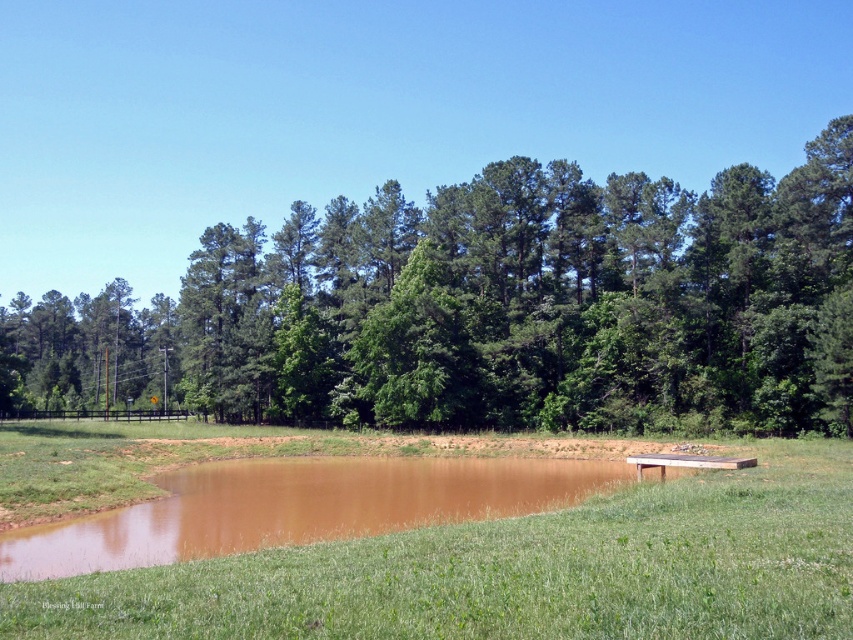
Question: Among these points, which one is farthest from the camera?

Choices:
 (A) (618, 349)
 (B) (747, 499)

Answer: (A)

Question: Which point is farther from the camera taking this photo?

Choices:
 (A) (341, 376)
 (B) (718, 580)

Answer: (A)

Question: Does green leafy tree at center appear under green grass at lower center?

Choices:
 (A) yes
 (B) no

Answer: (B)

Question: Does green leafy tree at center lie in front of green grass at lower center?

Choices:
 (A) yes
 (B) no

Answer: (B)

Question: Where is green leafy tree at center located in relation to green grass at lower center in the image?

Choices:
 (A) below
 (B) above

Answer: (B)